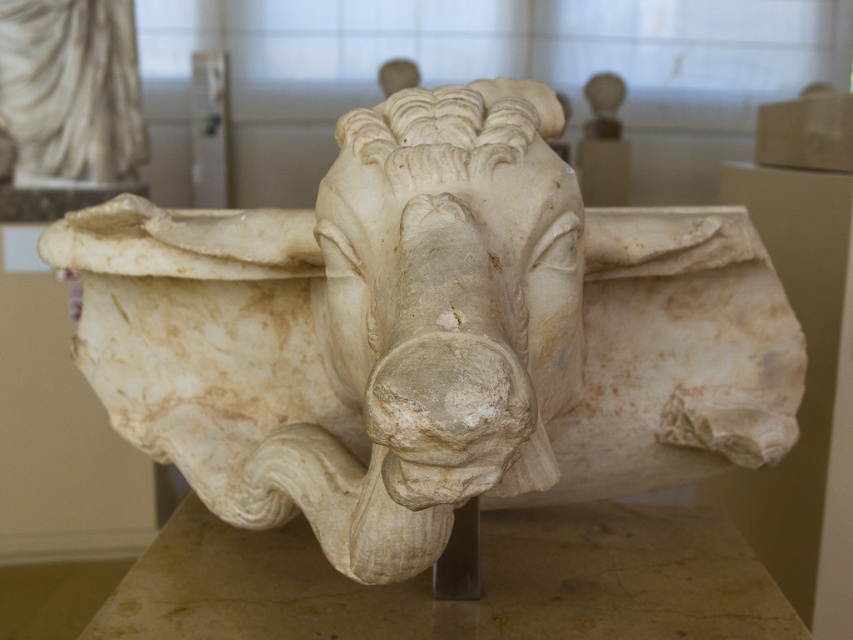
Question: Among these objects, which one is nearest to the camera?

Choices:
 (A) white marble bull head at center
 (B) white marble bull at center

Answer: (A)

Question: Is white marble bull at center closer to the viewer compared to white marble bull head at center?

Choices:
 (A) yes
 (B) no

Answer: (B)

Question: In this image, where is white marble bull at center located relative to white marble bull head at center?

Choices:
 (A) above
 (B) below

Answer: (B)

Question: Can you confirm if white marble bull at center is wider than white marble bull head at center?

Choices:
 (A) yes
 (B) no

Answer: (A)